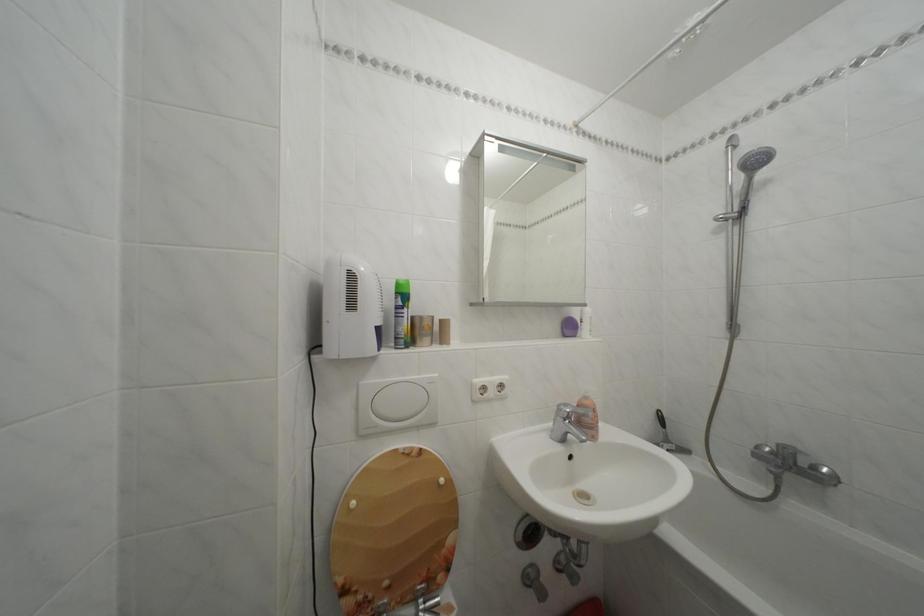
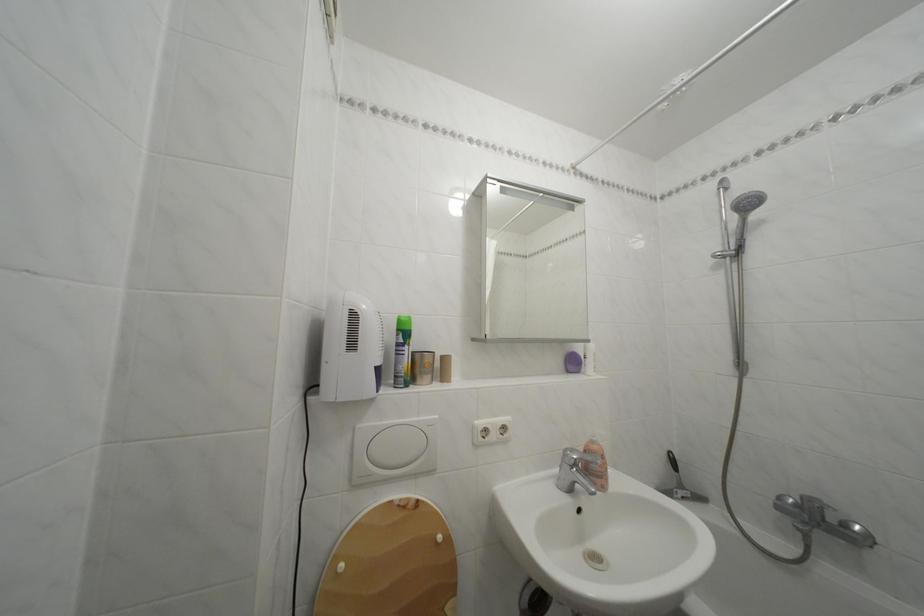
The point at (781, 460) is marked in the first image. Where is the corresponding point in the second image?

(806, 512)